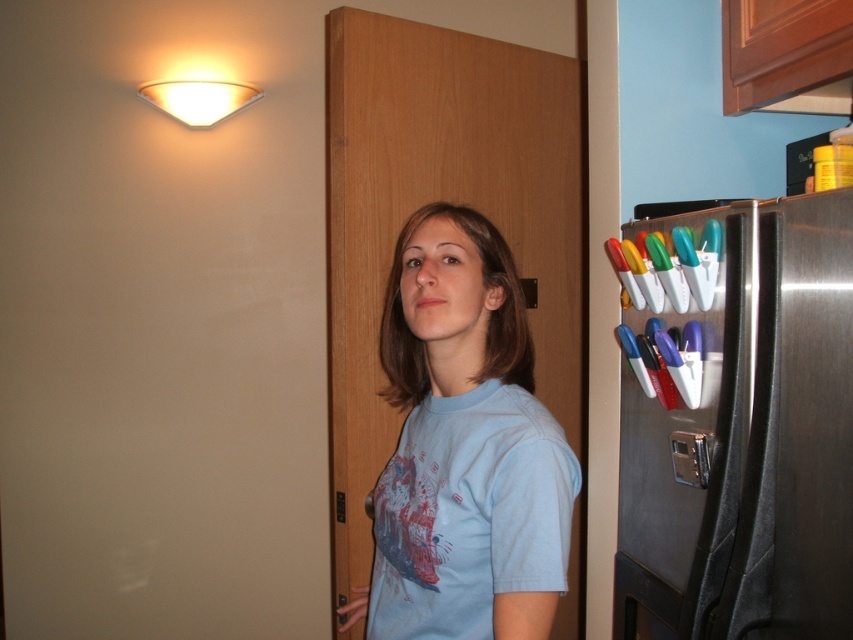
Question: In this image, where is stainless steel refrigerator at right located relative to light blue cotton shirt at center?

Choices:
 (A) below
 (B) above

Answer: (A)

Question: Is stainless steel refrigerator at right below light blue cotton shirt at center?

Choices:
 (A) yes
 (B) no

Answer: (A)

Question: Among these objects, which one is farthest from the camera?

Choices:
 (A) light blue cotton shirt at center
 (B) stainless steel refrigerator at right

Answer: (A)

Question: Which point is farther to the camera?

Choices:
 (A) (450, 577)
 (B) (776, 513)

Answer: (A)

Question: Is stainless steel refrigerator at right above light blue cotton shirt at center?

Choices:
 (A) yes
 (B) no

Answer: (B)